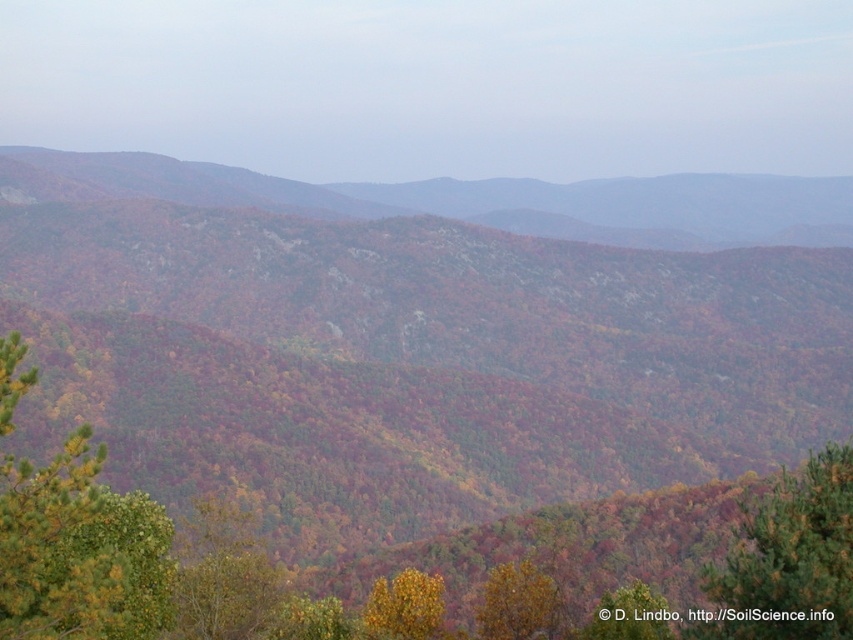
Question: Can you confirm if golden yellow pine at left is thinner than green leafy tree at center?

Choices:
 (A) no
 (B) yes

Answer: (B)

Question: Is golden-brown bark tree at lower center wider than green leafy tree at center?

Choices:
 (A) no
 (B) yes

Answer: (A)

Question: Estimate the real-world distances between objects in this image. Which object is closer to the golden-brown bark tree at lower center?

Choices:
 (A) multicolored foliage at center
 (B) green leafy tree at center
 (C) green matte tree at lower right
 (D) yellow matte tree at lower center

Answer: (D)

Question: Based on their relative distances, which object is farther from the green matte tree at lower right?

Choices:
 (A) green leafy tree at center
 (B) golden-brown bark tree at lower center
 (C) yellow matte tree at lower center
 (D) multicolored foliage at center

Answer: (D)

Question: Which point is closer to the camera?

Choices:
 (A) (227, 173)
 (B) (621, 630)

Answer: (B)

Question: Does golden yellow pine at left have a larger size compared to green leafy tree at center?

Choices:
 (A) yes
 (B) no

Answer: (B)